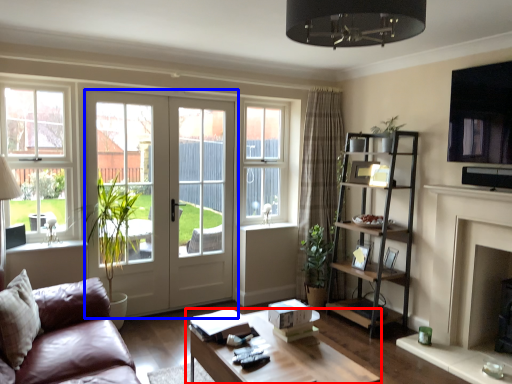
Question: Which object appears farthest to the camera in this image, coffee table (highlighted by a red box) or door (highlighted by a blue box)?

Choices:
 (A) coffee table
 (B) door

Answer: (B)